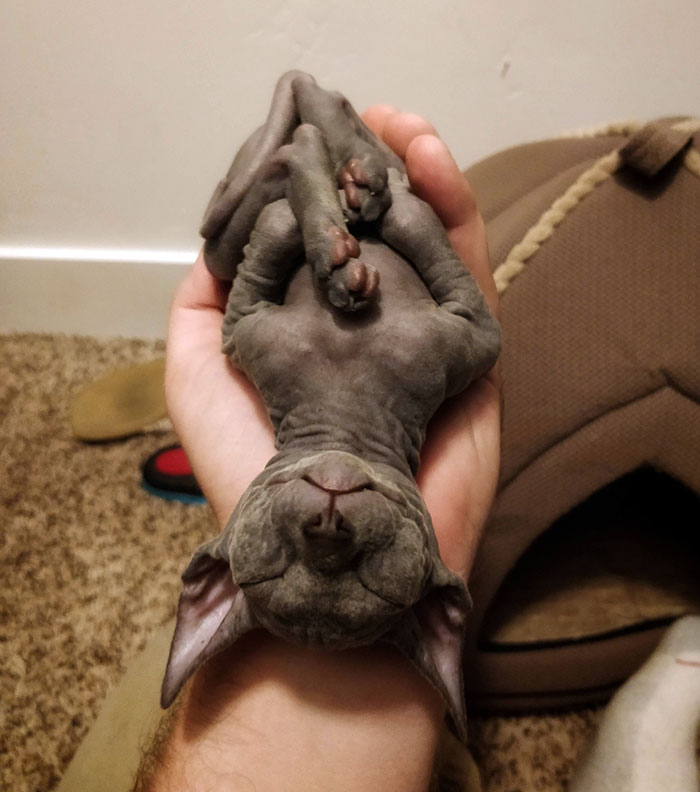
Where is `chair`? This screenshot has width=700, height=792. chair is located at coordinates (594, 288).